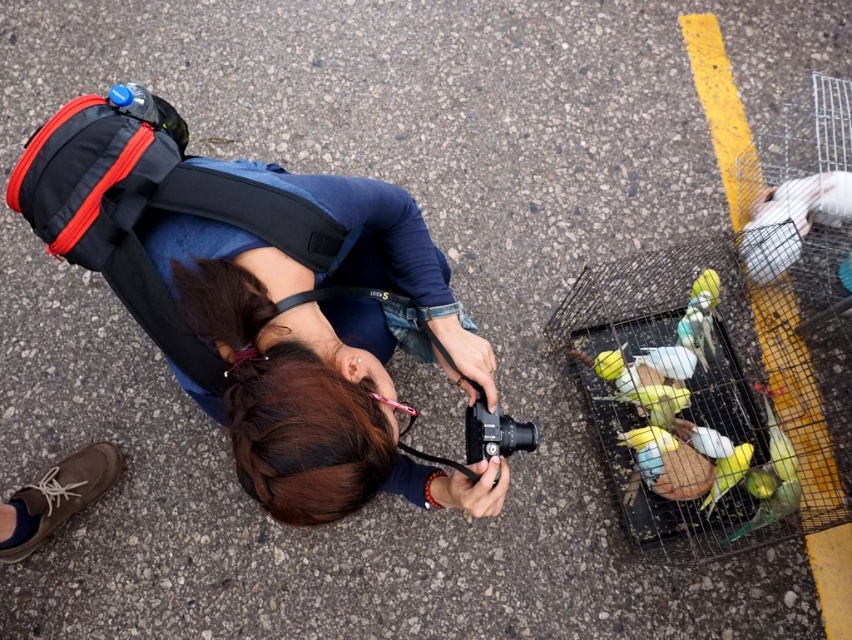
Question: Which object appears closest to the camera in this image?

Choices:
 (A) yellow matte parrot at lower right
 (B) white matte bird at right
 (C) matte black backpack at center

Answer: (C)

Question: Which of the following is the closest to the observer?

Choices:
 (A) white matte bird at right
 (B) matte black backpack at center
 (C) yellow matte parrot at lower right

Answer: (B)

Question: Does white matte bird at right have a greater width compared to yellow matte parrot at lower right?

Choices:
 (A) no
 (B) yes

Answer: (B)

Question: Which object appears farthest from the camera in this image?

Choices:
 (A) yellow matte parrot at lower right
 (B) white matte bird at right

Answer: (B)

Question: Can you confirm if matte black backpack at center is thinner than yellow matte parrot at lower right?

Choices:
 (A) yes
 (B) no

Answer: (B)

Question: Does white matte bird at right come behind yellow matte parrot at lower right?

Choices:
 (A) yes
 (B) no

Answer: (A)